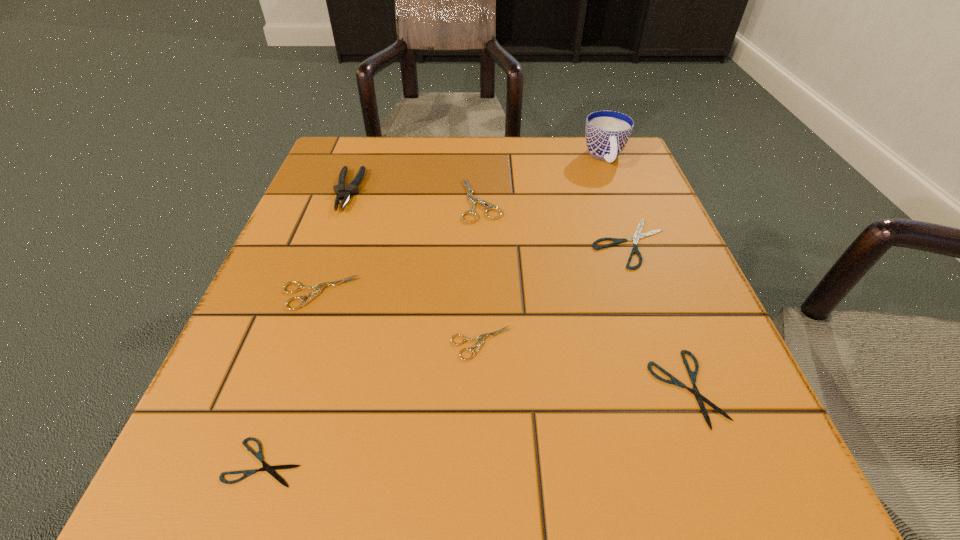
The width and height of the screenshot is (960, 540). I want to click on vacant point located on the right of the nearest black shears, so click(455, 462).

Where is `cup positioned at the far edge`? The width and height of the screenshot is (960, 540). cup positioned at the far edge is located at coordinates click(x=607, y=132).

What are the coordinates of `pliers present at the far edge` in the screenshot? It's located at point(352,188).

Locate an element on the screen. The height and width of the screenshot is (540, 960). shears that is at the far edge is located at coordinates (472, 200).

The width and height of the screenshot is (960, 540). I want to click on object that is at the near edge, so click(270, 469).

The height and width of the screenshot is (540, 960). What are the coordinates of `pliers that is at the left edge` in the screenshot? It's located at (352, 188).

Where is `cup positioned at the right edge`? Image resolution: width=960 pixels, height=540 pixels. cup positioned at the right edge is located at coordinates (607, 132).

Find the location of `object that is at the far left corner`. object that is at the far left corner is located at coordinates (352, 188).

Locate an element on the screen. object located at the near left corner is located at coordinates (270, 469).

You are a GUI agent. You are given a task and a screenshot of the screen. Output one action in this format:
    pyautogui.click(x=<x>, y=<y>)
    Task: Click on the object that is at the far right corner
    
    Given the screenshot: What is the action you would take?
    pyautogui.click(x=607, y=132)